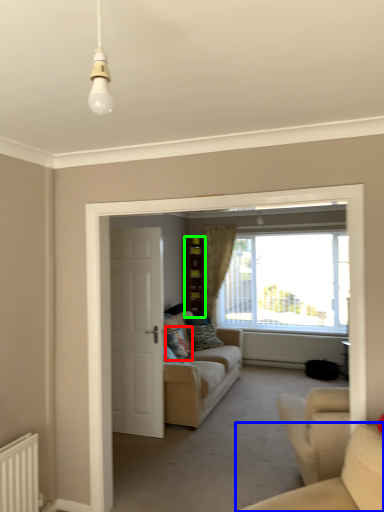
Question: Which is farther away from pillow (highlighted by a red box)? studio couch (highlighted by a blue box) or cabinetry (highlighted by a green box)?

Choices:
 (A) studio couch
 (B) cabinetry

Answer: (A)